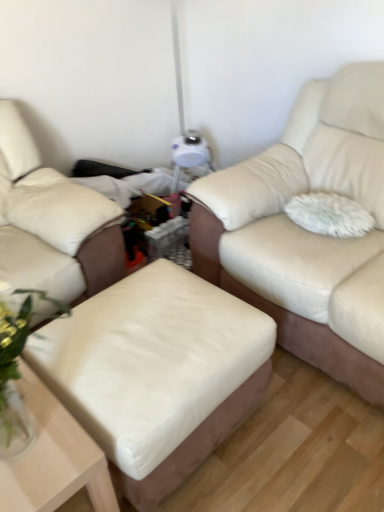
Question: From the image's perspective, is white fluffy pillow at right located above matte cream leather couch at center, which is counted as the 1th studio couch, starting from the right?

Choices:
 (A) yes
 (B) no

Answer: (B)

Question: Does white fluffy pillow at right have a greater width compared to matte cream leather couch at center, marked as the 2th studio couch in a left-to-right arrangement?

Choices:
 (A) yes
 (B) no

Answer: (B)

Question: Does white fluffy pillow at right appear on the right side of matte cream leather couch at center, marked as the 2th studio couch in a left-to-right arrangement?

Choices:
 (A) no
 (B) yes

Answer: (A)

Question: Is white fluffy pillow at right oriented away from matte cream leather couch at center, which is counted as the 1th studio couch, starting from the right?

Choices:
 (A) no
 (B) yes

Answer: (B)

Question: Considering the relative sizes of white fluffy pillow at right and matte cream leather couch at center, which is counted as the 1th studio couch, starting from the right, in the image provided, is white fluffy pillow at right thinner than matte cream leather couch at center, which is counted as the 1th studio couch, starting from the right,?

Choices:
 (A) yes
 (B) no

Answer: (A)

Question: Is white fluffy pillow at right in contact with matte cream leather couch at center, marked as the 2th studio couch in a left-to-right arrangement?

Choices:
 (A) yes
 (B) no

Answer: (B)

Question: Does beige leather ottoman at lower left, which is counted as the first studio couch, starting from the left, have a lesser width compared to white leather ottoman at center?

Choices:
 (A) no
 (B) yes

Answer: (A)

Question: From the image's perspective, is beige leather ottoman at lower left, which is counted as the first studio couch, starting from the left, located beneath white leather ottoman at center?

Choices:
 (A) no
 (B) yes

Answer: (A)

Question: Can you confirm if beige leather ottoman at lower left, which is counted as the first studio couch, starting from the left, is taller than white leather ottoman at center?

Choices:
 (A) yes
 (B) no

Answer: (A)

Question: From a real-world perspective, is beige leather ottoman at lower left, which appears as the 2th studio couch when viewed from the right, below white leather ottoman at center?

Choices:
 (A) yes
 (B) no

Answer: (B)

Question: Is beige leather ottoman at lower left, which is counted as the first studio couch, starting from the left, smaller than white leather ottoman at center?

Choices:
 (A) yes
 (B) no

Answer: (B)

Question: Is beige leather ottoman at lower left, which appears as the 2th studio couch when viewed from the right, further to camera compared to white leather ottoman at center?

Choices:
 (A) no
 (B) yes

Answer: (B)

Question: Does beige leather ottoman at lower left, which is counted as the first studio couch, starting from the left, come in front of matte cream leather couch at center, marked as the 2th studio couch in a left-to-right arrangement?

Choices:
 (A) no
 (B) yes

Answer: (A)